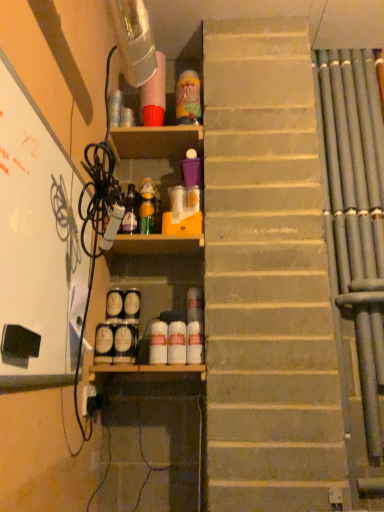
This screenshot has width=384, height=512. I want to click on translucent plastic bottle at center, the third bottle viewed from the top, so click(x=147, y=206).

The height and width of the screenshot is (512, 384). What do you see at coordinates (176, 343) in the screenshot? I see `white glossy bottle at center, which is the fourth bottle from top to bottom` at bounding box center [176, 343].

The image size is (384, 512). I want to click on white plastic electric outlet at lower left, so click(x=89, y=401).

The height and width of the screenshot is (512, 384). What do you see at coordinates (89, 401) in the screenshot?
I see `white plastic electric outlet at lower left` at bounding box center [89, 401].

What is the approximate height of white matte bottle at center, which appears as the third bottle when viewed from the left?

white matte bottle at center, which appears as the third bottle when viewed from the left, is 16.09 centimeters in height.

The image size is (384, 512). I want to click on translucent plastic bottle at upper center, the 1th bottle when ordered from right to left, so click(x=188, y=98).

From the image's perspective, is white matte bulletin board at left located beneath translucent plastic bottle at upper center, the 1th bottle when ordered from right to left?

Correct, white matte bulletin board at left appears lower than translucent plastic bottle at upper center, the 1th bottle when ordered from right to left, in the image.

Is white matte bulletin board at left oriented towards translucent plastic bottle at upper center, arranged as the 1th bottle when viewed from the top?

No, white matte bulletin board at left is not turned towards translucent plastic bottle at upper center, arranged as the 1th bottle when viewed from the top.

Between white matte bulletin board at left and translucent plastic bottle at upper center, the 1th bottle when ordered from right to left, which one has more height?

white matte bulletin board at left.

From a real-world perspective, relative to translucent plastic bottle at upper center, marked as the fifth bottle in a left-to-right arrangement, is white matte bulletin board at left vertically above or below?

white matte bulletin board at left is below translucent plastic bottle at upper center, marked as the fifth bottle in a left-to-right arrangement.

Based on the photo, could you tell me if translucent plastic bottle at upper center, the 1th bottle when ordered from right to left, is facing matte glass bottle at center, marked as the first bottle in a left-to-right arrangement?

No, translucent plastic bottle at upper center, the 1th bottle when ordered from right to left, is not facing towards matte glass bottle at center, marked as the first bottle in a left-to-right arrangement.

In the scene shown: From their relative heights in the image, would you say translucent plastic bottle at upper center, the fifth bottle when ordered from bottom to top, is taller or shorter than matte glass bottle at center, the fourth bottle from the bottom?

Clearly, translucent plastic bottle at upper center, the fifth bottle when ordered from bottom to top, is taller compared to matte glass bottle at center, the fourth bottle from the bottom.

Looking at this image, does translucent plastic bottle at upper center, marked as the fifth bottle in a left-to-right arrangement, have a smaller size compared to matte glass bottle at center, marked as the first bottle in a left-to-right arrangement?

Incorrect, translucent plastic bottle at upper center, marked as the fifth bottle in a left-to-right arrangement, is not smaller in size than matte glass bottle at center, marked as the first bottle in a left-to-right arrangement.

Between translucent plastic bottle at upper center, arranged as the 1th bottle when viewed from the top, and matte glass bottle at center, marked as the first bottle in a left-to-right arrangement, which one appears on the right side from the viewer's perspective?

Positioned to the right is translucent plastic bottle at upper center, arranged as the 1th bottle when viewed from the top.

This screenshot has height=512, width=384. What are the coordinates of `the 1st bottle behind the white matte bottle at center, the 1th bottle from the bottom, counting from the anchor's position` in the screenshot? It's located at (130, 212).

Can you tell me how much matte glass bottle at center, marked as the first bottle in a left-to-right arrangement, and white matte bottle at center, the 5th bottle positioned from the top, differ in facing direction?

They differ by 3.11 degrees in their facing directions.

From the picture: Considering the positions of objects matte glass bottle at center, the 2th bottle positioned from the top, and white matte bottle at center, the 1th bottle from the bottom, in the image provided, who is behind, matte glass bottle at center, the 2th bottle positioned from the top, or white matte bottle at center, the 1th bottle from the bottom,?

matte glass bottle at center, the 2th bottle positioned from the top, is more distant.

Considering the points (170, 330) and (84, 409), which point is behind, point (170, 330) or point (84, 409)?

The point (170, 330) is more distant.

From the image's perspective, which is above, white glossy bottle at center, marked as the 4th bottle in a left-to-right arrangement, or white plastic electric outlet at lower left?

From the image's view, white glossy bottle at center, marked as the 4th bottle in a left-to-right arrangement, is above.

Measure the distance from white glossy bottle at center, which is the second bottle from right to left, to white plastic electric outlet at lower left.

white glossy bottle at center, which is the second bottle from right to left, is 14.07 inches away from white plastic electric outlet at lower left.

Does white glossy bottle at center, which is the fourth bottle from top to bottom, have a lesser height compared to translucent plastic bottle at upper center, the fifth bottle when ordered from bottom to top?

Indeed, white glossy bottle at center, which is the fourth bottle from top to bottom, has a lesser height compared to translucent plastic bottle at upper center, the fifth bottle when ordered from bottom to top.

From the image's perspective, does white glossy bottle at center, marked as the 4th bottle in a left-to-right arrangement, appear higher than translucent plastic bottle at upper center, the fifth bottle when ordered from bottom to top?

Actually, white glossy bottle at center, marked as the 4th bottle in a left-to-right arrangement, appears below translucent plastic bottle at upper center, the fifth bottle when ordered from bottom to top, in the image.

Is white glossy bottle at center, which is the second bottle from right to left, inside or outside of translucent plastic bottle at upper center, the fifth bottle when ordered from bottom to top?

white glossy bottle at center, which is the second bottle from right to left, is not enclosed by translucent plastic bottle at upper center, the fifth bottle when ordered from bottom to top.

How different are the orientations of white glossy bottle at center, marked as the 4th bottle in a left-to-right arrangement, and translucent plastic bottle at upper center, marked as the fifth bottle in a left-to-right arrangement, in degrees?

They differ by 2.63 degrees in their facing directions.

Can you confirm if translucent plastic bottle at upper center, marked as the fifth bottle in a left-to-right arrangement, is smaller than white matte bulletin board at left?

Yes, translucent plastic bottle at upper center, marked as the fifth bottle in a left-to-right arrangement, is smaller than white matte bulletin board at left.

Is point (184, 105) farther from viewer compared to point (54, 279)?

That is True.

Which of these two, translucent plastic bottle at upper center, arranged as the 1th bottle when viewed from the top, or white matte bulletin board at left, is thinner?

With smaller width is white matte bulletin board at left.

Does translucent plastic bottle at upper center, the fifth bottle when ordered from bottom to top, appear on the left side of white matte bulletin board at left?

No.

Does white matte bulletin board at left have a smaller size compared to matte glass bottle at center, marked as the first bottle in a left-to-right arrangement?

Incorrect, white matte bulletin board at left is not smaller in size than matte glass bottle at center, marked as the first bottle in a left-to-right arrangement.

Do you think white matte bulletin board at left is within matte glass bottle at center, acting as the 5th bottle starting from the right, or outside of it?

white matte bulletin board at left lies outside matte glass bottle at center, acting as the 5th bottle starting from the right.

From the image's perspective, who appears lower, white matte bulletin board at left or matte glass bottle at center, marked as the first bottle in a left-to-right arrangement?

From the image's view, white matte bulletin board at left is below.

Considering the positions of objects white matte bulletin board at left and matte glass bottle at center, marked as the first bottle in a left-to-right arrangement, in the image provided, who is more to the left, white matte bulletin board at left or matte glass bottle at center, marked as the first bottle in a left-to-right arrangement,?

white matte bulletin board at left is more to the left.

Where is `bulletin board below the translucent plastic bottle at upper center, the fifth bottle when ordered from bottom to top (from the image's perspective)`? bulletin board below the translucent plastic bottle at upper center, the fifth bottle when ordered from bottom to top (from the image's perspective) is located at coordinates (37, 245).

I want to click on the 4th bottle counting from the right side of the matte glass bottle at center, the fourth bottle from the bottom, so click(x=188, y=98).

Based on their spatial positions, is white glossy bottle at center, which is the fourth bottle from top to bottom, or white plastic electric outlet at lower left closer to matte glass bottle at center, the fourth bottle from the bottom?

white glossy bottle at center, which is the fourth bottle from top to bottom, lies closer to matte glass bottle at center, the fourth bottle from the bottom, than the other object.

Based on their spatial positions, is white plastic electric outlet at lower left or white glossy bottle at center, the 2th bottle in the bottom-to-top sequence, further from white matte bottle at center, the 1th bottle from the bottom?

white plastic electric outlet at lower left lies further to white matte bottle at center, the 1th bottle from the bottom, than the other object.

Which object lies further to the anchor point matte glass bottle at center, marked as the first bottle in a left-to-right arrangement, translucent plastic bottle at center, the third bottle viewed from the top, or white glossy bottle at center, the 2th bottle in the bottom-to-top sequence?

white glossy bottle at center, the 2th bottle in the bottom-to-top sequence, is positioned further to the anchor matte glass bottle at center, marked as the first bottle in a left-to-right arrangement.

Based on their spatial positions, is translucent plastic bottle at center, the third bottle viewed from the top, or white matte bottle at center, the 1th bottle from the bottom, further from translucent plastic bottle at upper center, marked as the fifth bottle in a left-to-right arrangement?

white matte bottle at center, the 1th bottle from the bottom.

Based on their spatial positions, is matte glass bottle at center, the 2th bottle positioned from the top, or white matte bulletin board at left further from translucent plastic bottle at center, the third bottle viewed from the top?

white matte bulletin board at left lies further to translucent plastic bottle at center, the third bottle viewed from the top, than the other object.

From the picture: Estimate the real-world distances between objects in this image. Which object is closer to white glossy bottle at center, which is the second bottle from right to left, matte glass bottle at center, the fourth bottle from the bottom, or white matte bulletin board at left?

matte glass bottle at center, the fourth bottle from the bottom, lies closer to white glossy bottle at center, which is the second bottle from right to left, than the other object.

Estimate the real-world distances between objects in this image. Which object is closer to translucent plastic bottle at upper center, arranged as the 1th bottle when viewed from the top, white matte bottle at center, which is the third bottle in right-to-left order, or white glossy bottle at center, marked as the 4th bottle in a left-to-right arrangement?

Among the two, white matte bottle at center, which is the third bottle in right-to-left order, is located nearer to translucent plastic bottle at upper center, arranged as the 1th bottle when viewed from the top.

Looking at this image, from the image, which object appears to be farther from translucent plastic bottle at center, arranged as the third bottle when ordered from the bottom, matte glass bottle at center, acting as the 5th bottle starting from the right, or white matte bottle at center, the 5th bottle positioned from the top?

The object further to translucent plastic bottle at center, arranged as the third bottle when ordered from the bottom, is white matte bottle at center, the 5th bottle positioned from the top.

You are a GUI agent. You are given a task and a screenshot of the screen. Output one action in this format:
    pyautogui.click(x=<x>, y=<y>)
    Task: Click on the electric outlet between white matte bulletin board at left and matte glass bottle at center, marked as the first bottle in a left-to-right arrangement, in the front-back direction
    
    Given the screenshot: What is the action you would take?
    pyautogui.click(x=89, y=401)

Image resolution: width=384 pixels, height=512 pixels. Identify the location of bottle between translucent plastic bottle at upper center, marked as the fifth bottle in a left-to-right arrangement, and translucent plastic bottle at center, arranged as the third bottle when ordered from the bottom, vertically. (130, 212).

This screenshot has width=384, height=512. In order to click on electric outlet between white matte bulletin board at left and white glossy bottle at center, which is the second bottle from right to left, in the front-back direction in this screenshot , I will do `click(89, 401)`.

This screenshot has height=512, width=384. Find the location of `bottle between translucent plastic bottle at center, acting as the 4th bottle starting from the right, and white matte bottle at center, which appears as the third bottle when viewed from the left, vertically`. bottle between translucent plastic bottle at center, acting as the 4th bottle starting from the right, and white matte bottle at center, which appears as the third bottle when viewed from the left, vertically is located at coordinates (176, 343).